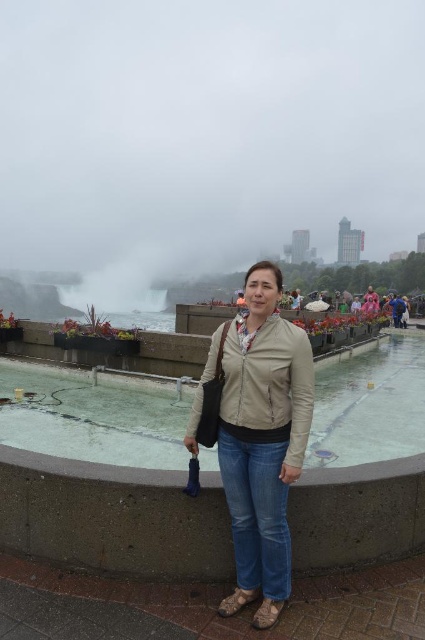
In the scene shown: Is clear glass water at center to the right of beige leather jacket at center from the viewer's perspective?

Indeed, clear glass water at center is positioned on the right side of beige leather jacket at center.

Between point (399, 362) and point (220, 412), which one is positioned in front?

Point (220, 412)

The height and width of the screenshot is (640, 425). What are the coordinates of `clear glass water at center` in the screenshot? It's located at (95, 416).